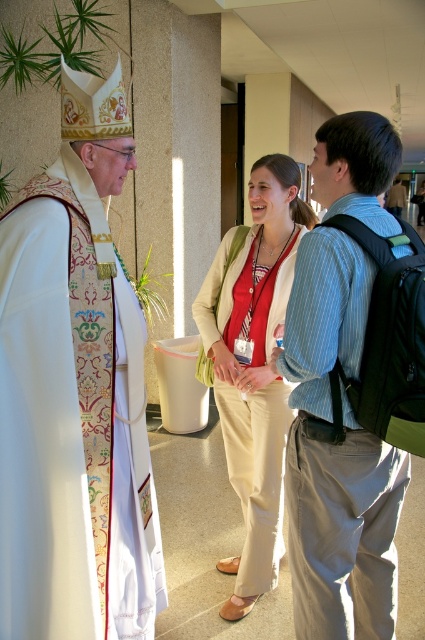
Question: Considering the real-world distances, which object is closest to the embroidered silk robe at left?

Choices:
 (A) beige cotton pants at center
 (B) striped cotton shirt at center

Answer: (B)

Question: From the image, what is the correct spatial relationship of striped cotton shirt at center in relation to beige cotton pants at center?

Choices:
 (A) below
 (B) above

Answer: (B)

Question: In this image, where is embroidered silk robe at left located relative to striped cotton shirt at center?

Choices:
 (A) left
 (B) right

Answer: (A)

Question: Which object is farther from the camera taking this photo?

Choices:
 (A) striped cotton shirt at center
 (B) beige cotton pants at center

Answer: (B)

Question: Which object is the farthest from the embroidered silk robe at left?

Choices:
 (A) striped cotton shirt at center
 (B) beige cotton pants at center

Answer: (B)

Question: Does embroidered silk robe at left appear on the right side of striped cotton shirt at center?

Choices:
 (A) yes
 (B) no

Answer: (B)